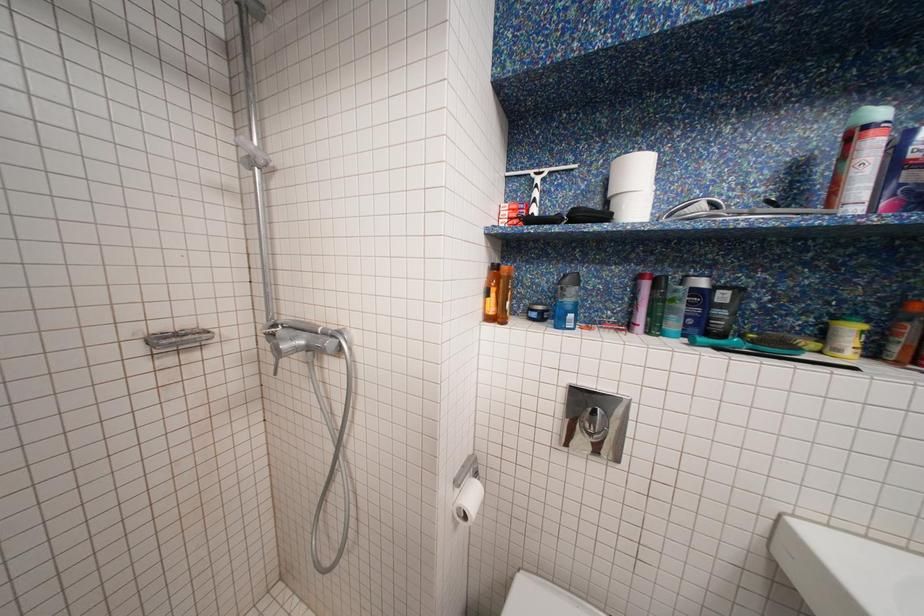
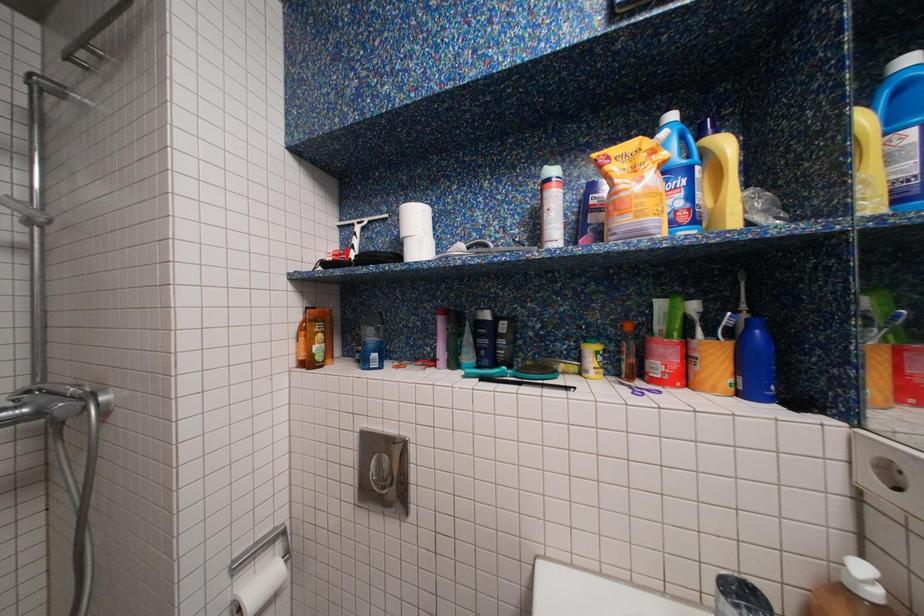
Question: What movement of the cameraman would produce the second image?

Choices:
 (A) Left
 (B) Right
 (C) Forward
 (D) Backward

Answer: (B)